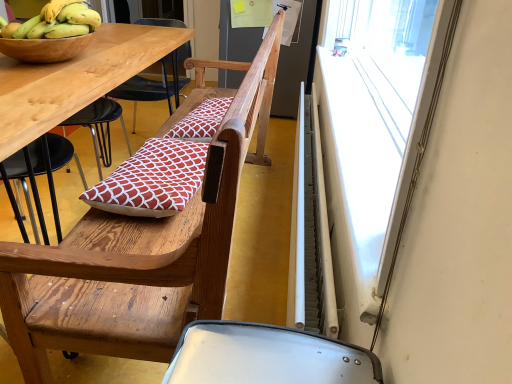
Question: From the image's perspective, is yellow bananas at upper left below white plastic window screen at upper right?

Choices:
 (A) no
 (B) yes

Answer: (A)

Question: Considering the relative positions of yellow bananas at upper left and white plastic window screen at upper right in the image provided, is yellow bananas at upper left to the right of white plastic window screen at upper right from the viewer's perspective?

Choices:
 (A) no
 (B) yes

Answer: (A)

Question: From a real-world perspective, is yellow bananas at upper left on white plastic window screen at upper right?

Choices:
 (A) no
 (B) yes

Answer: (B)

Question: From the image's perspective, is yellow bananas at upper left above white plastic window screen at upper right?

Choices:
 (A) no
 (B) yes

Answer: (B)

Question: Is yellow bananas at upper left outside of white plastic window screen at upper right?

Choices:
 (A) no
 (B) yes

Answer: (B)

Question: Considering the positions of red printed cushion at center, acting as the first pillow starting from the front, and red printed fabric pillow at center, placed as the first pillow when sorted from top to bottom, in the image, is red printed cushion at center, acting as the first pillow starting from the front, bigger or smaller than red printed fabric pillow at center, placed as the first pillow when sorted from top to bottom,?

Choices:
 (A) big
 (B) small

Answer: (A)

Question: From the image's perspective, is red printed cushion at center, the 2th pillow from the top, positioned above or below red printed fabric pillow at center, placed as the first pillow when sorted from top to bottom?

Choices:
 (A) below
 (B) above

Answer: (A)

Question: From a real-world perspective, is red printed cushion at center, arranged as the second pillow when viewed from the back, above or below red printed fabric pillow at center, placed as the first pillow when sorted from top to bottom?

Choices:
 (A) above
 (B) below

Answer: (B)

Question: Is red printed cushion at center, arranged as the second pillow when viewed from the back, inside or outside of red printed fabric pillow at center, marked as the second pillow in a bottom-to-top arrangement?

Choices:
 (A) inside
 (B) outside

Answer: (B)

Question: Based on their sizes in the image, would you say yellow bananas at upper left is bigger or smaller than red printed cushion at center, arranged as the second pillow when viewed from the back?

Choices:
 (A) big
 (B) small

Answer: (B)

Question: In terms of height, does yellow bananas at upper left look taller or shorter compared to red printed cushion at center, arranged as the second pillow when viewed from the back?

Choices:
 (A) short
 (B) tall

Answer: (B)

Question: Do you think yellow bananas at upper left is within red printed cushion at center, the first pillow positioned from the bottom, or outside of it?

Choices:
 (A) outside
 (B) inside

Answer: (A)

Question: Considering their positions, is yellow bananas at upper left located in front of or behind red printed cushion at center, the first pillow positioned from the bottom?

Choices:
 (A) behind
 (B) front

Answer: (A)

Question: Which is correct: white metallic radiator at right is inside red printed fabric pillow at center, which is the second pillow from front to back, or outside of it?

Choices:
 (A) inside
 (B) outside

Answer: (B)

Question: Considering the positions of white metallic radiator at right and red printed fabric pillow at center, placed as the first pillow when sorted from top to bottom, in the image, is white metallic radiator at right bigger or smaller than red printed fabric pillow at center, placed as the first pillow when sorted from top to bottom,?

Choices:
 (A) big
 (B) small

Answer: (A)